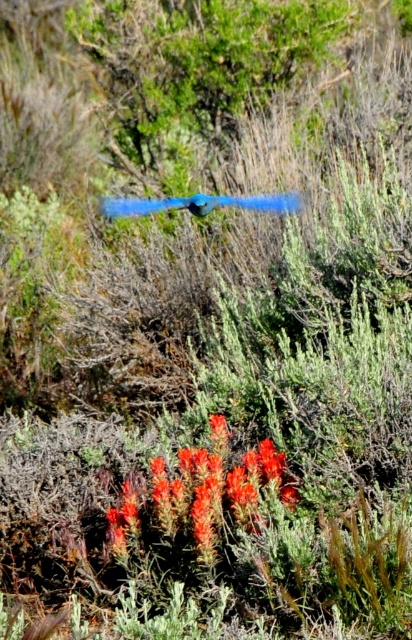
Question: Is bright orange textured flower at lower center below blue feathered bird at center?

Choices:
 (A) yes
 (B) no

Answer: (A)

Question: Which point is farther from the camera taking this photo?

Choices:
 (A) (243, 200)
 (B) (163, 512)

Answer: (A)

Question: Observing the image, what is the correct spatial positioning of bright orange textured flower at lower center in reference to blue feathered bird at center?

Choices:
 (A) below
 (B) above

Answer: (A)

Question: In this image, where is bright orange textured flower at lower center located relative to blue feathered bird at center?

Choices:
 (A) below
 (B) above

Answer: (A)